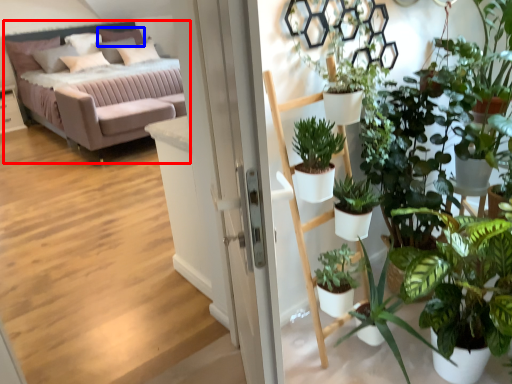
Question: Which point is closer to the camera, studio couch (highlighted by a red box) or pillow (highlighted by a blue box)?

Choices:
 (A) studio couch
 (B) pillow

Answer: (A)